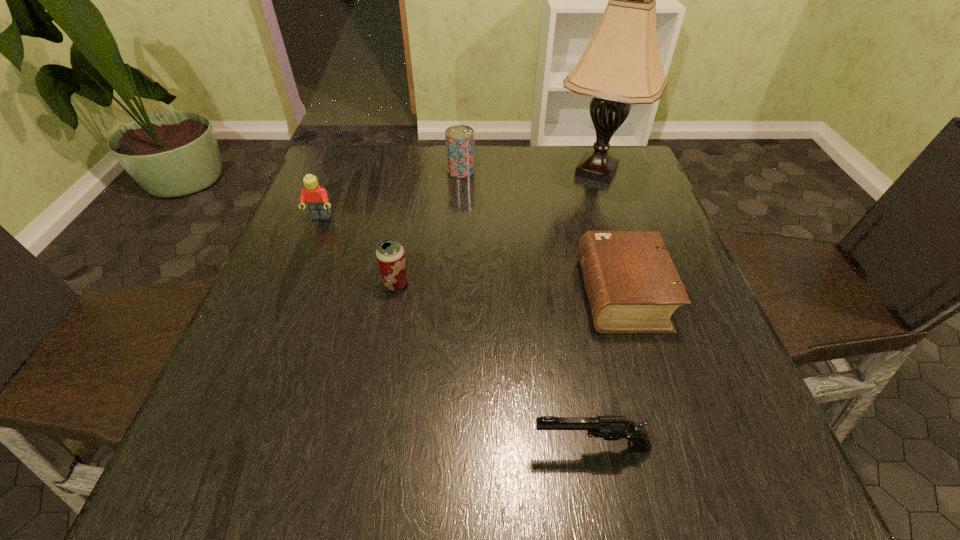
Identify the location of the tallest object. Image resolution: width=960 pixels, height=540 pixels. (621, 65).

The image size is (960, 540). I want to click on the farther beer can, so click(459, 139).

Identify the location of the right beer can. (459, 139).

At what (x,y) coordinates should I click in order to perform the action: click on Lego. Please return your answer as a coordinate pair (x, y). This screenshot has width=960, height=540. Looking at the image, I should click on (316, 197).

Where is `the third farthest object`? the third farthest object is located at coordinates (316, 197).

Find the location of a particular element. The width and height of the screenshot is (960, 540). the nearer beer can is located at coordinates (390, 254).

The image size is (960, 540). Find the location of `the second object from left to right`. the second object from left to right is located at coordinates (390, 254).

Identify the location of the nearest object. (612, 427).

What are the coordinates of `Bible` in the screenshot? It's located at (632, 285).

The image size is (960, 540). In order to click on free spot located 0.150m on the left of the lamp in this screenshot , I will do click(x=495, y=171).